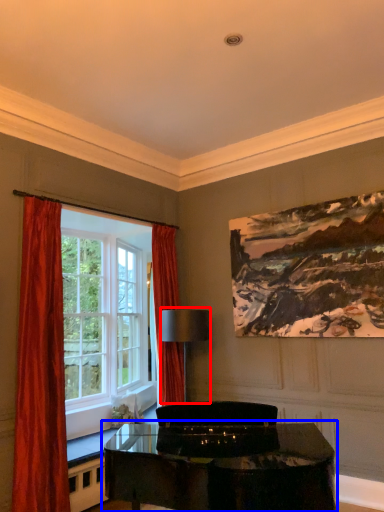
Question: Among these objects, which one is nearest to the camera, lamp (highlighted by a red box) or table (highlighted by a blue box)?

Choices:
 (A) lamp
 (B) table

Answer: (B)